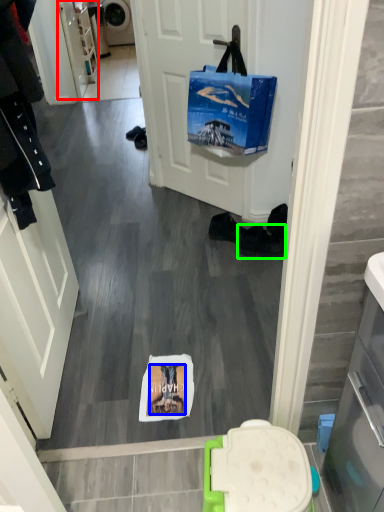
Question: Which is farther away from cabinetry (highlighted by a red box)? person (highlighted by a blue box) or footwear (highlighted by a green box)?

Choices:
 (A) person
 (B) footwear

Answer: (A)